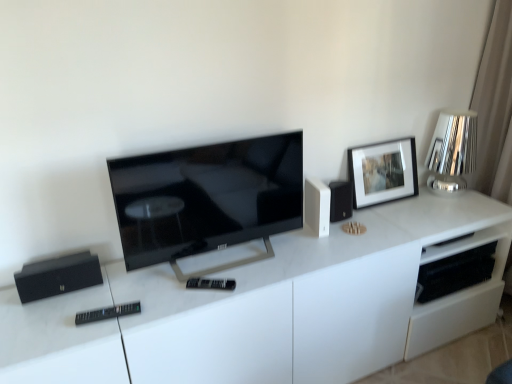
This screenshot has width=512, height=384. I want to click on vacant space situated on the left part of white matte speaker at upper right, so click(289, 241).